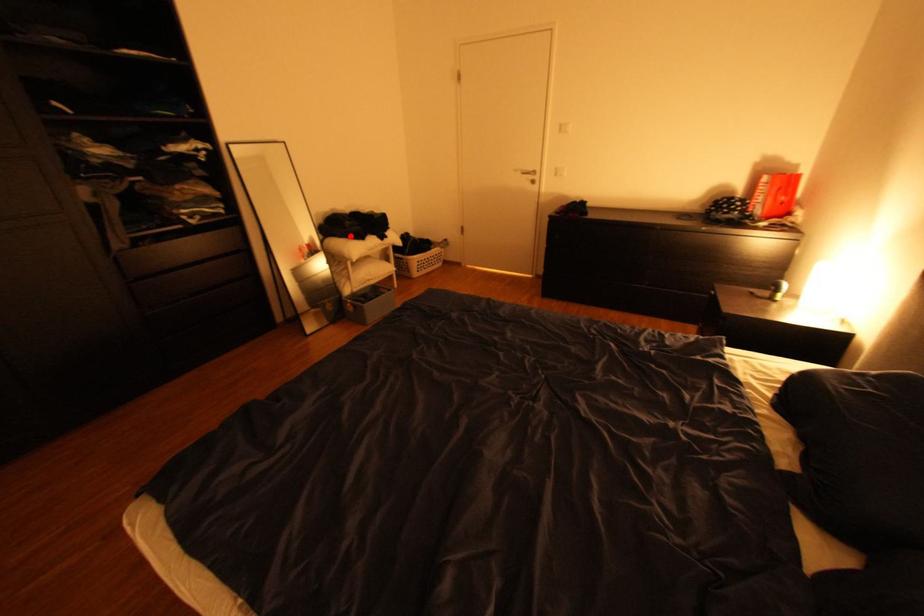
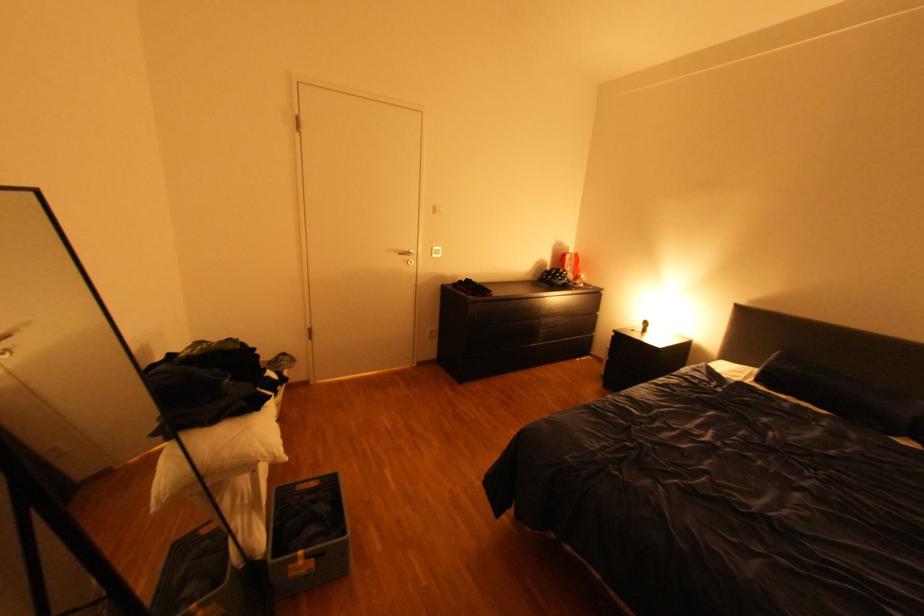
Where in the second image is the point corresponding to the highlighted location from the first image?

(223, 421)